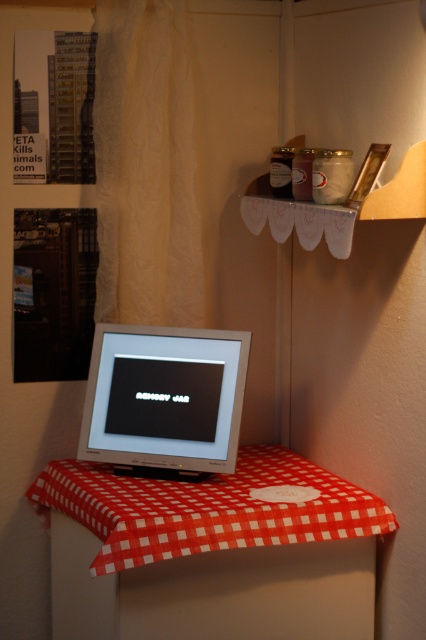
Question: Can you confirm if red checkered cloth at center is wider than satin silver monitor at center?

Choices:
 (A) no
 (B) yes

Answer: (B)

Question: From the image, what is the correct spatial relationship of beige paper curtain at upper left in relation to satin silver monitor at center?

Choices:
 (A) below
 (B) above

Answer: (B)

Question: Which point appears farthest from the camera in this image?

Choices:
 (A) (189, 358)
 (B) (173, 16)
 (C) (201, 516)

Answer: (B)

Question: Is beige paper curtain at upper left further to the viewer compared to satin silver monitor at center?

Choices:
 (A) no
 (B) yes

Answer: (B)

Question: Estimate the real-world distances between objects in this image. Which object is closer to the satin silver monitor at center?

Choices:
 (A) beige paper curtain at upper left
 (B) red checkered cloth at center

Answer: (B)

Question: Based on their relative distances, which object is farther from the red checkered cloth at center?

Choices:
 (A) beige paper curtain at upper left
 (B) satin silver monitor at center

Answer: (A)